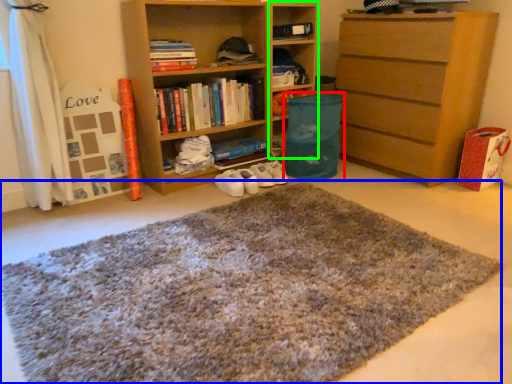
Question: Considering the real-world distances, which object is closest to bean bag chair (highlighted by a red box)? doormat (highlighted by a blue box) or cabinet (highlighted by a green box).

Choices:
 (A) doormat
 (B) cabinet

Answer: (B)